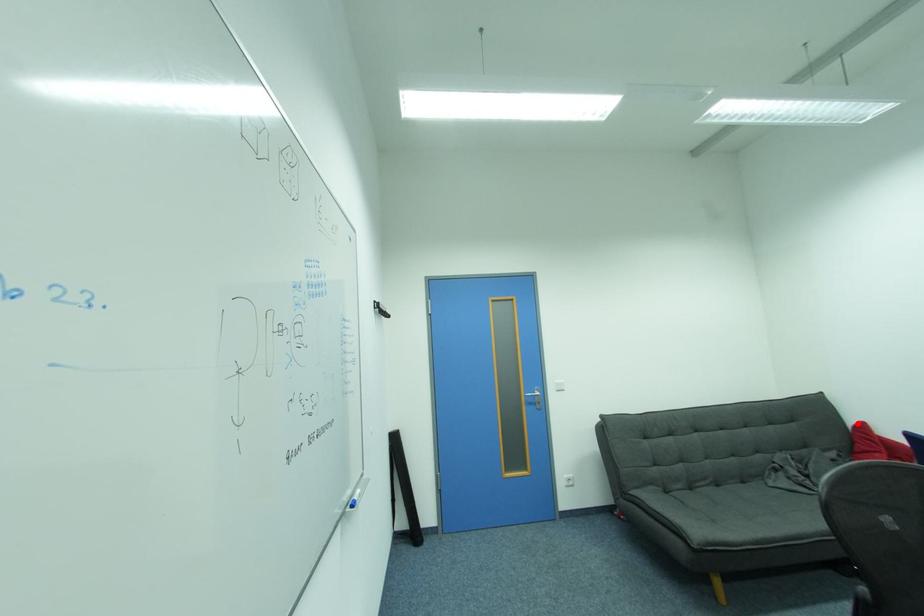
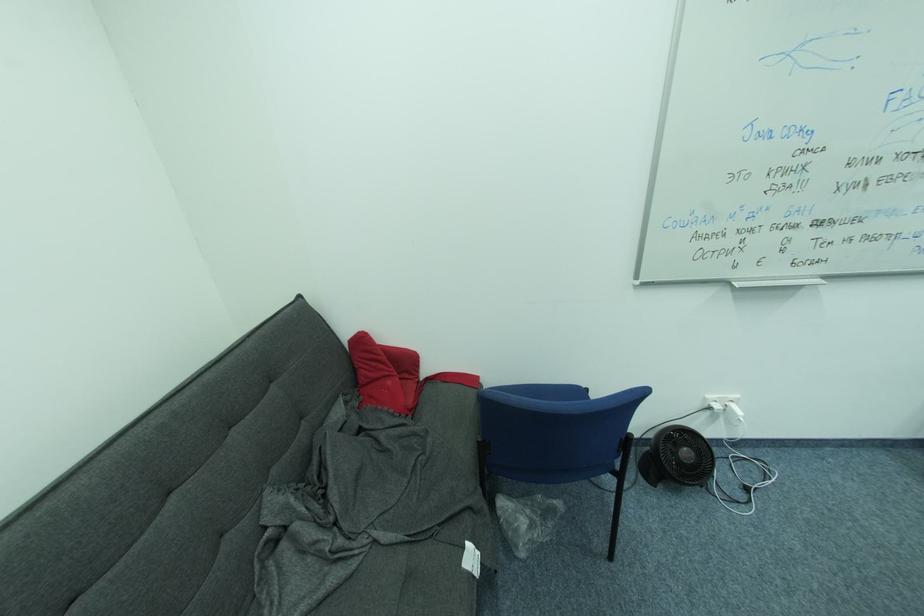
Question: I am providing you with two images of the same scene from different viewpoints. Given a red point in image1, look at the same physical point in image2. Is it:

Choices:
 (A) Closer to the viewpoint
 (B) Farther from the viewpoint

Answer: (A)